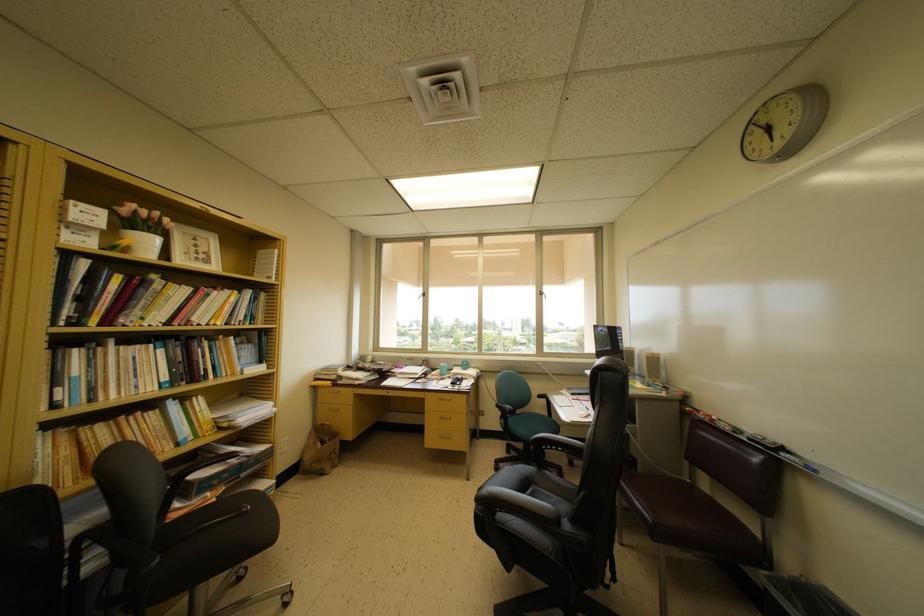
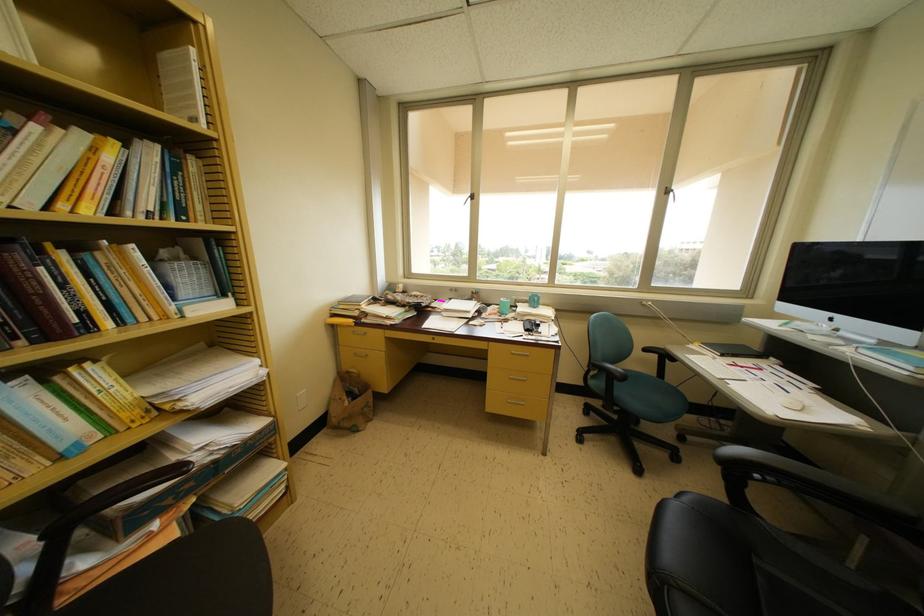
In the second image, find the point that corresponds to pixel 310 468 in the first image.

(337, 424)